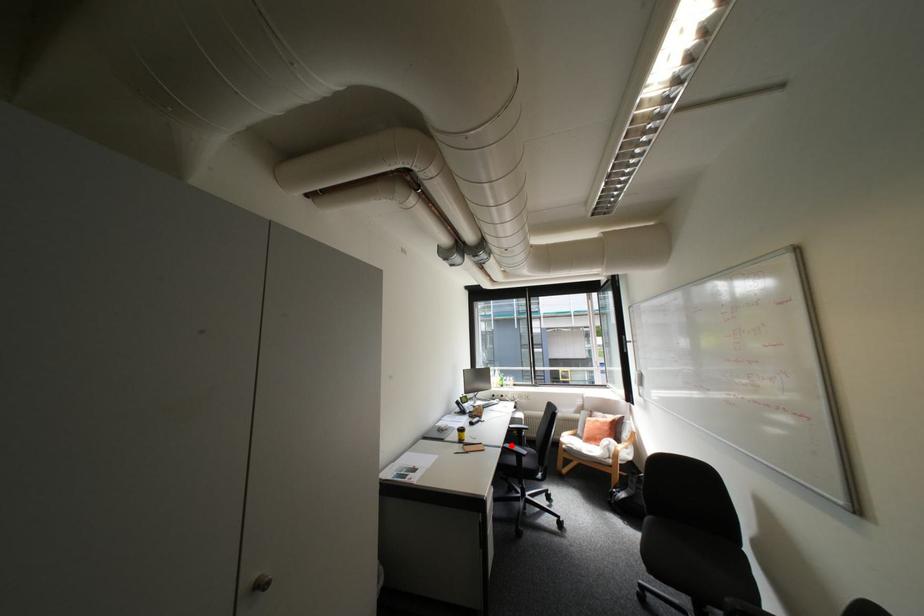
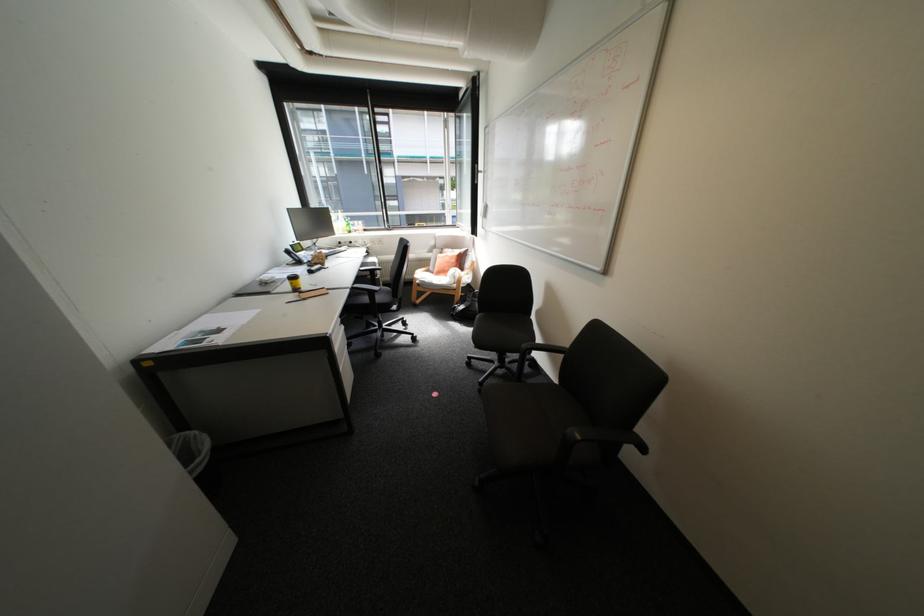
In the second image, find the point that corresponds to the highlighted location in the first image.

(359, 286)